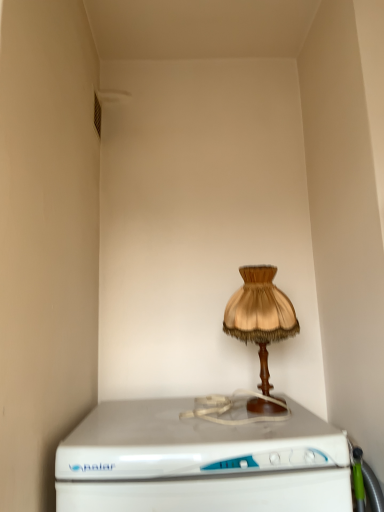
Locate an element on the screen. This screenshot has width=384, height=512. satin brown lampshade at center is located at coordinates (260, 315).

The width and height of the screenshot is (384, 512). What do you see at coordinates (260, 315) in the screenshot?
I see `satin brown lampshade at center` at bounding box center [260, 315].

Find the location of `satin brown lampshade at center`. satin brown lampshade at center is located at coordinates coord(260,315).